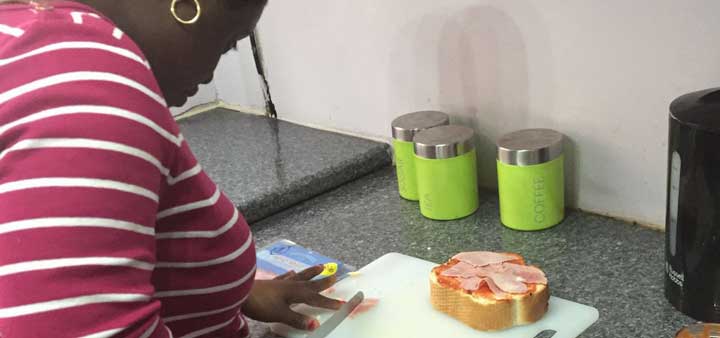
Locate an element on the screen. green jars is located at coordinates (450, 182), (508, 191), (399, 165).